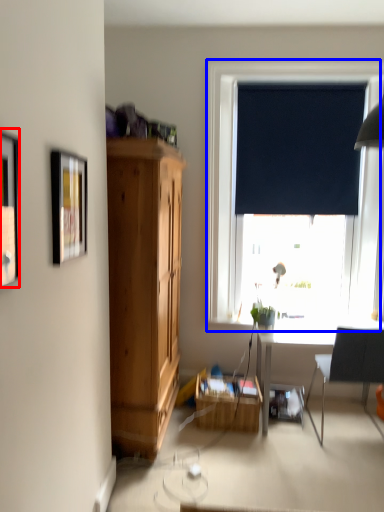
Question: Which object appears closest to the camera in this image, picture frame (highlighted by a red box) or window (highlighted by a blue box)?

Choices:
 (A) picture frame
 (B) window

Answer: (A)